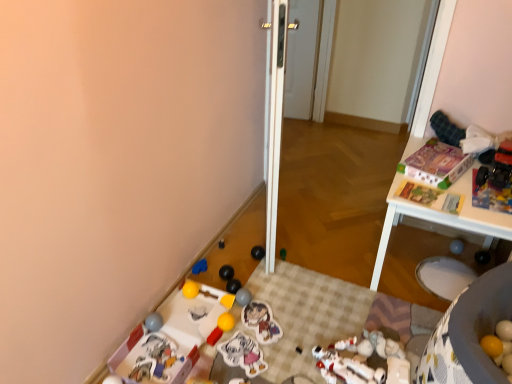
Identify the location of unoccupied region to the right of matte plastic sticker at center, marked as the seventh toy in a right-to-left arrangement. This screenshot has width=512, height=384. (302, 324).